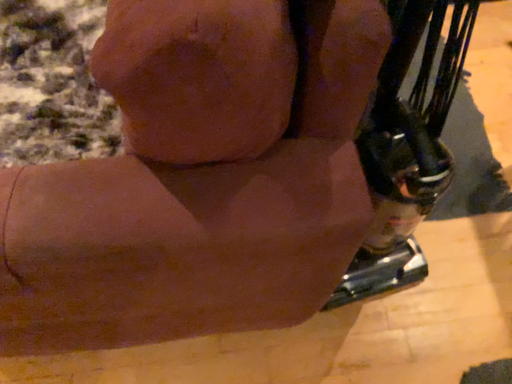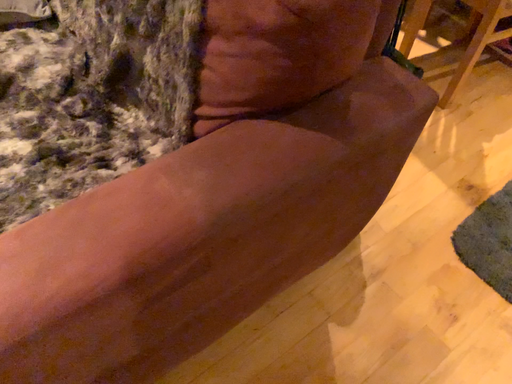
Question: Which way did the camera rotate in the video?

Choices:
 (A) rotated downward
 (B) rotated upward

Answer: (B)